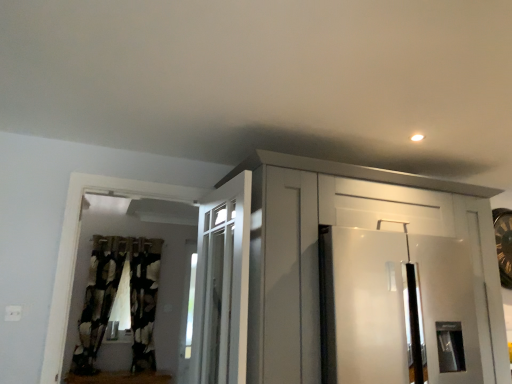
Question: From the image's perspective, does black textured curtain at left, which appears as the 1th curtain when viewed from the left, appear lower than black textured curtain at left, arranged as the 1th curtain when viewed from the right?

Choices:
 (A) no
 (B) yes

Answer: (A)

Question: Does black textured curtain at left, the 2th curtain positioned from the right, have a lesser width compared to black textured curtain at left, arranged as the 1th curtain when viewed from the right?

Choices:
 (A) yes
 (B) no

Answer: (A)

Question: From the image's perspective, would you say black textured curtain at left, the 2th curtain positioned from the right, is positioned over black textured curtain at left, arranged as the 1th curtain when viewed from the right?

Choices:
 (A) no
 (B) yes

Answer: (B)

Question: Would you say black textured curtain at left, which appears as the 1th curtain when viewed from the left, contains black textured curtain at left, arranged as the 1th curtain when viewed from the right?

Choices:
 (A) no
 (B) yes

Answer: (A)

Question: Is black textured curtain at left, the 2th curtain positioned from the right, to the left of black textured curtain at left, arranged as the 1th curtain when viewed from the right, from the viewer's perspective?

Choices:
 (A) no
 (B) yes

Answer: (B)

Question: Is black textured curtain at left, which appears as the 1th curtain when viewed from the left, smaller than black textured curtain at left, the 2th curtain positioned from the left?

Choices:
 (A) yes
 (B) no

Answer: (B)

Question: Is white glossy cabinet at upper center positioned far away from black textured curtain at left, the 2th curtain positioned from the left?

Choices:
 (A) yes
 (B) no

Answer: (A)

Question: From a real-world perspective, is white glossy cabinet at upper center located beneath black textured curtain at left, arranged as the 1th curtain when viewed from the right?

Choices:
 (A) no
 (B) yes

Answer: (A)

Question: Can you confirm if white glossy cabinet at upper center is thinner than black textured curtain at left, the 2th curtain positioned from the left?

Choices:
 (A) yes
 (B) no

Answer: (B)

Question: Does white glossy cabinet at upper center appear on the left side of black textured curtain at left, arranged as the 1th curtain when viewed from the right?

Choices:
 (A) yes
 (B) no

Answer: (B)

Question: Does white glossy cabinet at upper center lie in front of black textured curtain at left, arranged as the 1th curtain when viewed from the right?

Choices:
 (A) yes
 (B) no

Answer: (A)

Question: Is white glossy cabinet at upper center facing away from black textured curtain at left, the 2th curtain positioned from the left?

Choices:
 (A) yes
 (B) no

Answer: (A)

Question: From a real-world perspective, is white glossy refrigerator at right over black textured curtain at left, the 2th curtain positioned from the left?

Choices:
 (A) yes
 (B) no

Answer: (B)